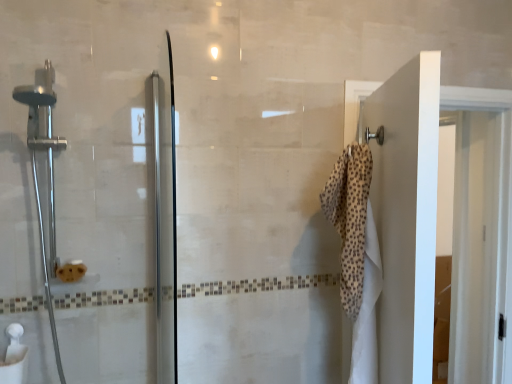
This screenshot has height=384, width=512. Identify the location of beige dotted towel at right. (350, 219).

The image size is (512, 384). What do you see at coordinates (350, 219) in the screenshot?
I see `beige dotted towel at right` at bounding box center [350, 219].

The height and width of the screenshot is (384, 512). I want to click on satin chrome shower head at left, so click(x=48, y=172).

Measure the distance between point (34, 175) and camera.

Point (34, 175) and camera are 4.44 feet apart.

Describe the element at coordinates (48, 172) in the screenshot. I see `satin chrome shower head at left` at that location.

Where is `beige dotted towel at right`? beige dotted towel at right is located at coordinates (350, 219).

Considering the relative positions of beige dotted towel at right and satin chrome shower head at left in the image provided, is beige dotted towel at right to the left of satin chrome shower head at left from the viewer's perspective?

Incorrect, beige dotted towel at right is not on the left side of satin chrome shower head at left.

Which object is further away from the camera taking this photo, beige dotted towel at right or satin chrome shower head at left?

beige dotted towel at right is behind.

Between point (332, 218) and point (40, 223), which one is positioned in front?

The point (40, 223) is in front.

From the image's perspective, is beige dotted towel at right positioned above or below satin chrome shower head at left?

Based on their image positions, beige dotted towel at right is located beneath satin chrome shower head at left.

From a real-world perspective, is beige dotted towel at right physically located above or below satin chrome shower head at left?

beige dotted towel at right is situated lower than satin chrome shower head at left in the real world.

Looking at this image, which object is thinner, beige dotted towel at right or satin chrome shower head at left?

Thinner between the two is beige dotted towel at right.

Who is taller, beige dotted towel at right or satin chrome shower head at left?

With more height is satin chrome shower head at left.

Considering the relative sizes of beige dotted towel at right and satin chrome shower head at left in the image provided, is beige dotted towel at right bigger than satin chrome shower head at left?

Incorrect, beige dotted towel at right is not larger than satin chrome shower head at left.

Is beige dotted towel at right surrounding satin chrome shower head at left?

No.

Is beige dotted towel at right beside satin chrome shower head at left?

No, beige dotted towel at right is not in contact with satin chrome shower head at left.

Is beige dotted towel at right aimed at satin chrome shower head at left?

Yes, beige dotted towel at right is turned towards satin chrome shower head at left.

What's the angular difference between beige dotted towel at right and satin chrome shower head at left's facing directions?

They differ by 110 degrees in their facing directions.

At what (x,y) coordinates should I click in order to perform the action: click on shower lying above the beige dotted towel at right (from the image's perspective). Please return your answer as a coordinate pair (x, y). Looking at the image, I should click on (48, 172).

Does satin chrome shower head at left appear on the right side of beige dotted towel at right?

No.

Between satin chrome shower head at left and beige dotted towel at right, which one is positioned in front?

Positioned in front is satin chrome shower head at left.

Which is closer, (32, 170) or (351, 274)?

The point (351, 274) is closer to the camera.

From the image's perspective, is satin chrome shower head at left located above or below beige dotted towel at right?

Based on their image positions, satin chrome shower head at left is located above beige dotted towel at right.

From a real-world perspective, who is located higher, satin chrome shower head at left or beige dotted towel at right?

From a 3D spatial view, satin chrome shower head at left is above.

Looking at their sizes, would you say satin chrome shower head at left is wider or thinner than beige dotted towel at right?

Clearly, satin chrome shower head at left has more width compared to beige dotted towel at right.

Does satin chrome shower head at left have a greater height compared to beige dotted towel at right?

Yes.

Is satin chrome shower head at left smaller than beige dotted towel at right?

No, satin chrome shower head at left is not smaller than beige dotted towel at right.

Can beige dotted towel at right be found inside satin chrome shower head at left?

Actually, beige dotted towel at right is outside satin chrome shower head at left.

Is satin chrome shower head at left in contact with beige dotted towel at right?

They are not placed beside each other.

Could you tell me if satin chrome shower head at left is turned towards beige dotted towel at right?

No, satin chrome shower head at left is not turned towards beige dotted towel at right.

What's the angular difference between satin chrome shower head at left and beige dotted towel at right's facing directions?

They differ by 110 degrees in their facing directions.

This screenshot has height=384, width=512. In order to click on bath towel behind the satin chrome shower head at left in this screenshot , I will do `click(350, 219)`.

Find the location of a particular element. The width and height of the screenshot is (512, 384). bath towel below the satin chrome shower head at left (from a real-world perspective) is located at coordinates (350, 219).

This screenshot has height=384, width=512. In order to click on shower on the left of beige dotted towel at right in this screenshot , I will do `click(48, 172)`.